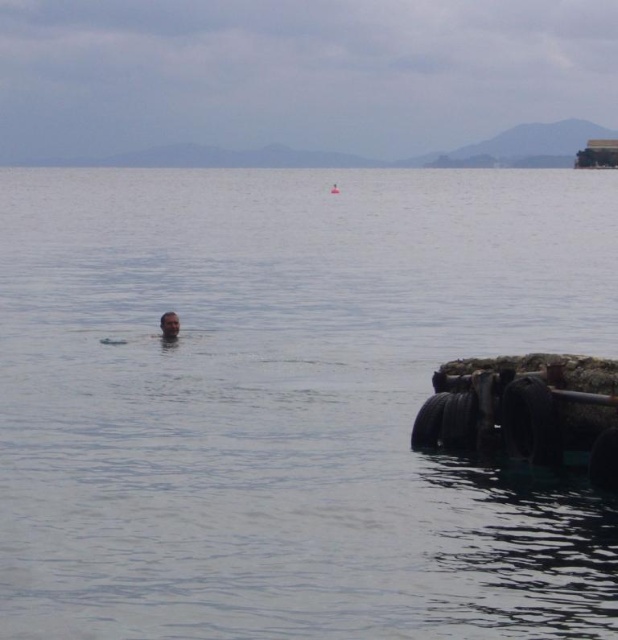
Between point (72, 266) and point (167, 340), which one is positioned behind?

Point (72, 266)

Is transparent water at center bigger than smooth skin head at center?

Yes, transparent water at center is bigger than smooth skin head at center.

Is point (263, 513) farther from viewer compared to point (179, 332)?

No, (263, 513) is closer to viewer.

Identify the location of transparent water at center. The width and height of the screenshot is (618, 640). (287, 403).

Based on the photo, can you confirm if smooth skin head at center is taller than smooth skin person at center?

In fact, smooth skin head at center may be shorter than smooth skin person at center.

Can you confirm if smooth skin head at center is smaller than smooth skin person at center?

Yes.

Is point (164, 317) closer to camera compared to point (337, 189)?

That is True.

You are a GUI agent. You are given a task and a screenshot of the screen. Output one action in this format:
    pyautogui.click(x=<x>, y=<y>)
    Task: Click on the smooth skin head at center
    This screenshot has width=618, height=640.
    Given the screenshot: What is the action you would take?
    pyautogui.click(x=169, y=324)

Is point (551, 397) positioned in front of point (176, 326)?

That is True.

Measure the distance between point (451,412) and camera.

Point (451,412) is 54.88 feet from camera.

Where is `rusty metal boat at lower right`? rusty metal boat at lower right is located at coordinates point(527,412).

What are the coordinates of `rusty metal boat at lower right` in the screenshot? It's located at (527, 412).